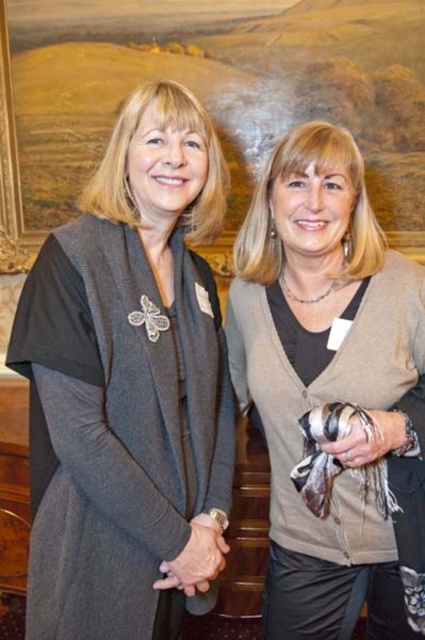
You are a fashion designer observing the image. You need to decide which item is narrower between the matte gray cardigan at center and the wooden frame at upper center. Which one is it?

The matte gray cardigan at center is thinner than the wooden frame at upper center, so the matte gray cardigan at center is narrower.

You are taking a photo of two women standing in a formal setting. You want to focus on the point closer to the camera. Which point should you choose between point (164, 188) and point (235, 348)?

Point (164, 188) is closer to the camera than point (235, 348), so you should choose point (164, 188) to focus on.

You are a photographer setting up for a portrait shoot in the described scene. You need to position a small light source between the matte gray scarf at center and the wooden frame at upper center. Based on their positions, where should you place the light source?

The matte gray scarf at center is located below the wooden frame at upper center, so the light source should be placed between them by positioning it just below the wooden frame at upper center but above the matte gray scarf at center.